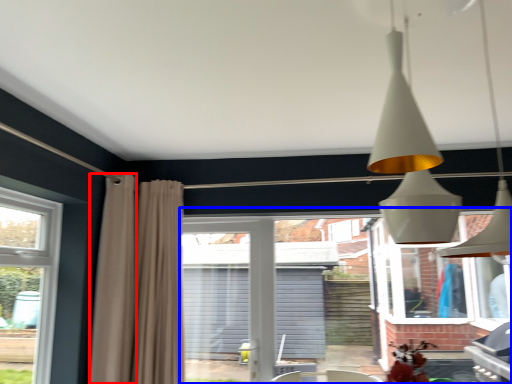
Question: Which object is closer to the camera taking this photo, curtain (highlighted by a red box) or backyard (highlighted by a blue box)?

Choices:
 (A) curtain
 (B) backyard

Answer: (A)